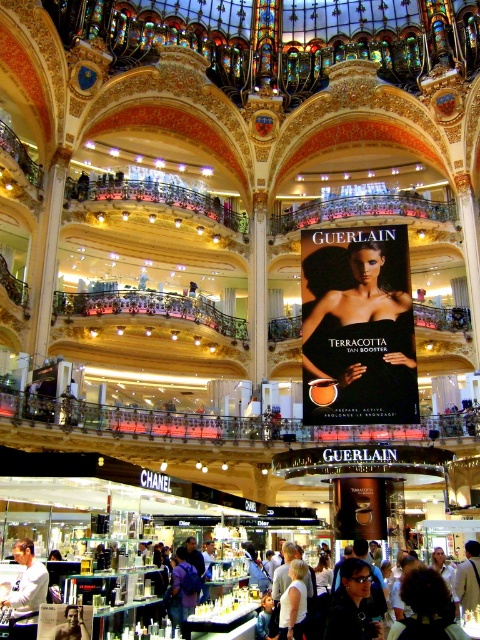
You are a customer in the mall and see the dark sunglasses at center and the smooth skin torso at center. Which item is positioned lower in the scene?

The dark sunglasses at center is located below the smooth skin torso at center, so it is positioned lower in the scene.

You are standing in the grand shopping mall and want to take a photo of both the point at coordinates [367,241] and the point at coordinates [351,586]. Which point should you focus on first to ensure both are in focus?

You should focus on the point at coordinates [367,241] first because it is closer to the camera than the point at coordinates [351,586]. This ensures both points will be in focus when using depth of field.

You are standing at the entrance of the grand shopping mall and see a matte black compact at center. Where exactly is the matte black compact located in the mall?

The matte black compact at center is located at point (358, 326) in the mall.